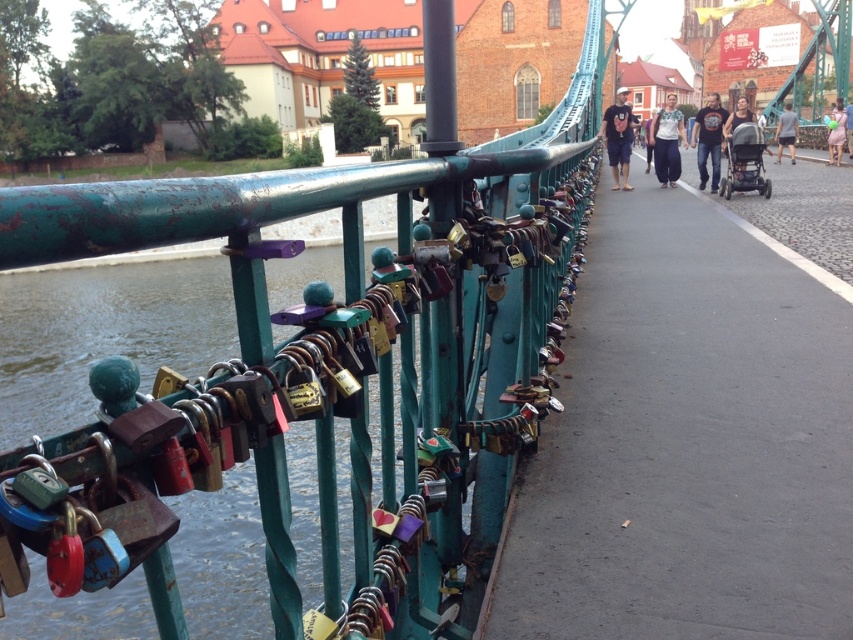
Question: Does green metal rail at upper left have a larger size compared to black t-shirt at center?

Choices:
 (A) no
 (B) yes

Answer: (A)

Question: Which object is positioned farthest from the green metal rail at upper left?

Choices:
 (A) black t-shirt at center
 (B) metallic padlocks at center
 (C) green matte metal pole at center
 (D) matte black backpack at center

Answer: (A)

Question: Which point is farther from the camera taking this photo?

Choices:
 (A) (448, 320)
 (B) (711, 129)
 (C) (790, 132)
 (D) (831, 161)

Answer: (C)

Question: Which is nearer to the light pink fabric dress at right?

Choices:
 (A) green metal rail at upper left
 (B) black t-shirt at center
 (C) green matte metal pole at center
 (D) metallic padlocks at center

Answer: (B)

Question: Can you confirm if matte black backpack at center is positioned to the left of black t-shirt at center?

Choices:
 (A) no
 (B) yes

Answer: (B)

Question: Does white cotton shirt at center have a smaller size compared to black t-shirt at center?

Choices:
 (A) no
 (B) yes

Answer: (B)